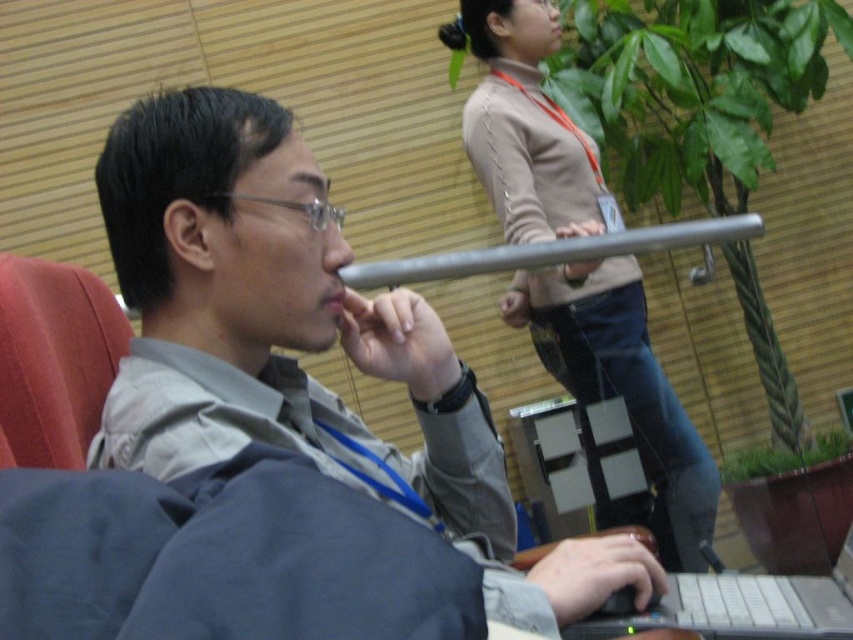
Between gray fabric shirt at center and beige sweater at upper center, which one appears on the left side from the viewer's perspective?

gray fabric shirt at center is more to the left.

Who is taller, gray fabric shirt at center or beige sweater at upper center?

With more height is beige sweater at upper center.

Does point (459, 426) come in front of point (543, 282)?

Yes.

Where is `gray fabric shirt at center`? gray fabric shirt at center is located at coordinates (302, 346).

Is point (534, 317) more distant than point (705, 596)?

Yes, it is behind point (705, 596).

Who is more distant from viewer, (701, 497) or (718, 618)?

Positioned behind is point (701, 497).

Is point (676, 420) in front of point (830, 595)?

No, it is behind (830, 595).

Find the location of a particular element. beige sweater at upper center is located at coordinates (625, 394).

Does gray fabric shirt at center have a larger size compared to black plastic laptop at lower right?

Correct, gray fabric shirt at center is larger in size than black plastic laptop at lower right.

Is gray fabric shirt at center taller than black plastic laptop at lower right?

Correct, gray fabric shirt at center is much taller as black plastic laptop at lower right.

Where is `gray fabric shirt at center`? gray fabric shirt at center is located at coordinates (302, 346).